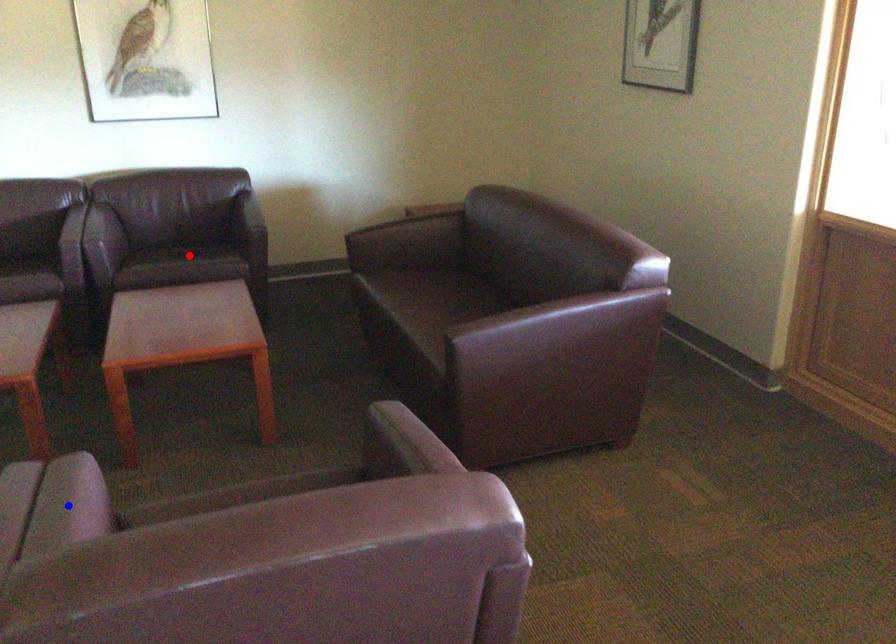
Question: Two points are marked on the image. Which point is closer to the camera?

Choices:
 (A) Blue point is closer.
 (B) Red point is closer.

Answer: (A)